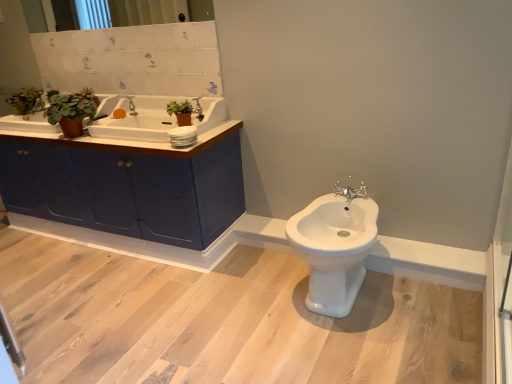
Where is `vacant area that is in front of white glossy bidet at center`? The image size is (512, 384). vacant area that is in front of white glossy bidet at center is located at coordinates (360, 352).